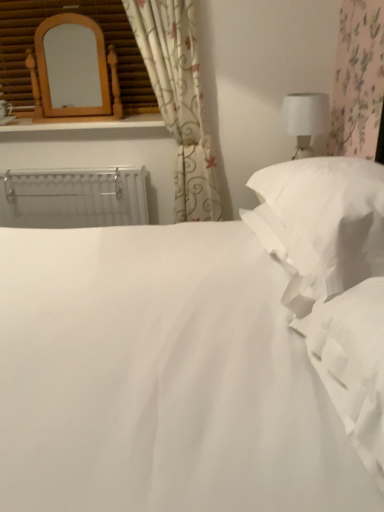
Question: From the image's perspective, does white soft pillow at right appear lower than white metallic radiator at left?

Choices:
 (A) no
 (B) yes

Answer: (B)

Question: Does white soft pillow at right have a greater height compared to white metallic radiator at left?

Choices:
 (A) yes
 (B) no

Answer: (B)

Question: Are white soft pillow at right and white metallic radiator at left making contact?

Choices:
 (A) yes
 (B) no

Answer: (B)

Question: Does white soft pillow at right turn towards white metallic radiator at left?

Choices:
 (A) yes
 (B) no

Answer: (B)

Question: Are white soft pillow at right and white metallic radiator at left located far from each other?

Choices:
 (A) yes
 (B) no

Answer: (A)

Question: Can you confirm if white soft pillow at right is smaller than white metallic radiator at left?

Choices:
 (A) no
 (B) yes

Answer: (A)

Question: Is white smooth bed at center to the right of white metallic radiator at left from the viewer's perspective?

Choices:
 (A) no
 (B) yes

Answer: (B)

Question: Considering the relative sizes of white smooth bed at center and white metallic radiator at left in the image provided, is white smooth bed at center bigger than white metallic radiator at left?

Choices:
 (A) yes
 (B) no

Answer: (A)

Question: From the image's perspective, would you say white smooth bed at center is shown under white metallic radiator at left?

Choices:
 (A) yes
 (B) no

Answer: (A)

Question: Is white smooth bed at center outside of white metallic radiator at left?

Choices:
 (A) no
 (B) yes

Answer: (B)

Question: From the image's perspective, is white smooth bed at center over white metallic radiator at left?

Choices:
 (A) no
 (B) yes

Answer: (A)

Question: Does white smooth bed at center have a smaller size compared to white metallic radiator at left?

Choices:
 (A) yes
 (B) no

Answer: (B)

Question: Can white fabric at right be found inside white metallic radiator at left?

Choices:
 (A) no
 (B) yes

Answer: (A)